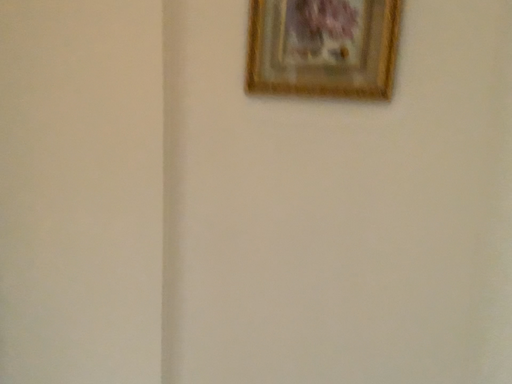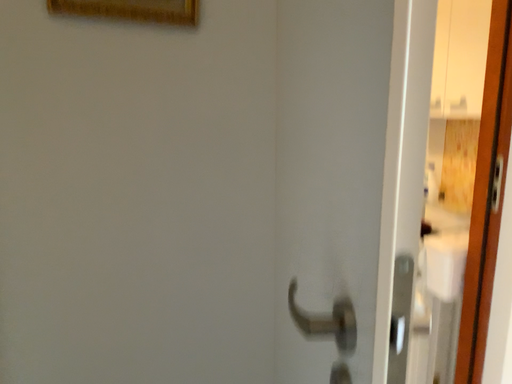
Question: How did the camera likely rotate when shooting the video?

Choices:
 (A) rotated left
 (B) rotated right

Answer: (B)